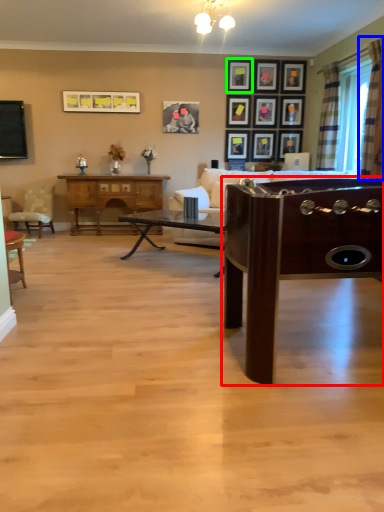
Question: Which is farther away from table (highlighted by a red box)? curtain (highlighted by a blue box) or picture frame (highlighted by a green box)?

Choices:
 (A) curtain
 (B) picture frame

Answer: (B)